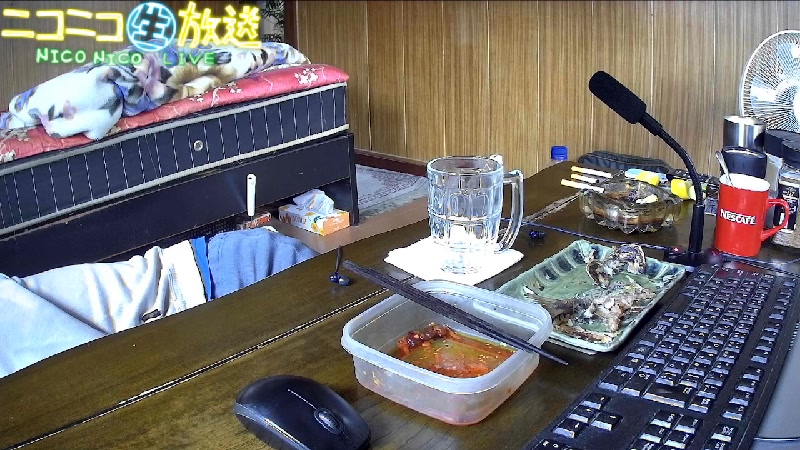
I want to click on mouse, so click(x=292, y=406).